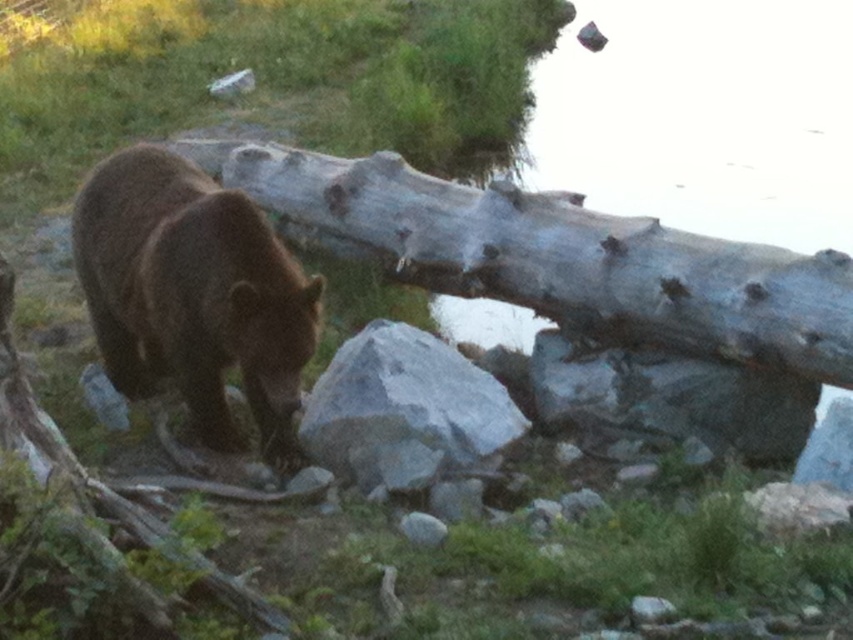
Question: Can you confirm if gray rough log at center is positioned to the left of brown furry bear at lower left?

Choices:
 (A) no
 (B) yes

Answer: (A)

Question: Does gray rough log at center appear on the right side of gray rock at center?

Choices:
 (A) no
 (B) yes

Answer: (B)

Question: Which object is farther from the camera taking this photo?

Choices:
 (A) gray rough log at center
 (B) brown furry bear at lower left
 (C) gray rock at center

Answer: (A)

Question: Considering the real-world distances, which object is farthest from the gray rock at center?

Choices:
 (A) brown furry bear at lower left
 (B) gray rough log at center

Answer: (B)

Question: Is brown furry bear at lower left to the left of gray rock at center from the viewer's perspective?

Choices:
 (A) yes
 (B) no

Answer: (A)

Question: Which is farther from the gray rock at center?

Choices:
 (A) gray rough log at center
 (B) brown furry bear at lower left

Answer: (A)